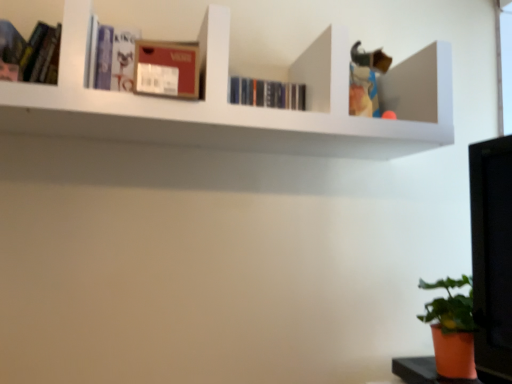
Question: Is orange matte pot at lower right surrounding matte black book at upper left, which is the first book in left-to-right order?

Choices:
 (A) yes
 (B) no

Answer: (B)

Question: Is orange matte pot at lower right bigger than matte black book at upper left, arranged as the 2th book when viewed from the back?

Choices:
 (A) yes
 (B) no

Answer: (A)

Question: Is matte black book at upper left, acting as the 1th book starting from the front, at the back of orange matte pot at lower right?

Choices:
 (A) no
 (B) yes

Answer: (A)

Question: From the image's perspective, is orange matte pot at lower right under matte black book at upper left, which is the first book in left-to-right order?

Choices:
 (A) yes
 (B) no

Answer: (A)

Question: Is orange matte pot at lower right at the left side of matte black book at upper left, acting as the 1th book starting from the front?

Choices:
 (A) yes
 (B) no

Answer: (B)

Question: Is matte purple book at upper left, the second book viewed from the left, in front of or behind orange matte pot at lower right in the image?

Choices:
 (A) behind
 (B) front

Answer: (B)

Question: From their relative heights in the image, would you say matte purple book at upper left, the 2th book viewed from the front, is taller or shorter than orange matte pot at lower right?

Choices:
 (A) short
 (B) tall

Answer: (A)

Question: From the image's perspective, relative to orange matte pot at lower right, is matte purple book at upper left, the first book viewed from the right, above or below?

Choices:
 (A) above
 (B) below

Answer: (A)

Question: From a real-world perspective, is matte purple book at upper left, the 2th book viewed from the front, above or below orange matte pot at lower right?

Choices:
 (A) above
 (B) below

Answer: (A)

Question: Does point (105, 28) appear closer or farther from the camera than point (0, 26)?

Choices:
 (A) farther
 (B) closer

Answer: (A)

Question: Is matte purple book at upper left, the 2th book viewed from the front, inside or outside of matte black book at upper left, placed as the second book when sorted from right to left?

Choices:
 (A) inside
 (B) outside

Answer: (B)

Question: Is matte purple book at upper left, the second book viewed from the left, wider or thinner than matte black book at upper left, arranged as the 2th book when viewed from the back?

Choices:
 (A) thin
 (B) wide

Answer: (B)

Question: From the image's perspective, relative to matte black book at upper left, acting as the 1th book starting from the front, is matte purple book at upper left, the second book viewed from the left, above or below?

Choices:
 (A) below
 (B) above

Answer: (B)

Question: Based on their positions, is matte cardboard box at upper center located to the left or right of orange matte pot at lower right?

Choices:
 (A) right
 (B) left

Answer: (B)

Question: Does point (162, 87) appear closer or farther from the camera than point (441, 309)?

Choices:
 (A) closer
 (B) farther

Answer: (A)